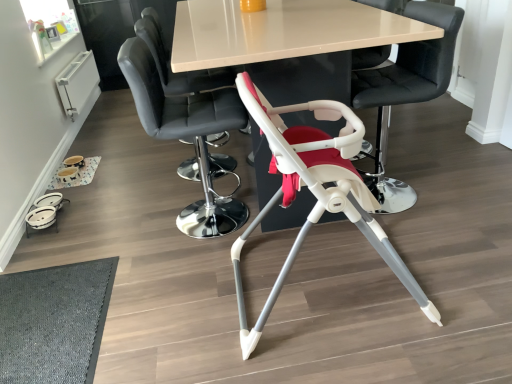
Question: Based on their positions, is dark gray textured mat at lower left located to the left or right of white plastic highchair at center, acting as the fourth chair starting from the left?

Choices:
 (A) left
 (B) right

Answer: (A)

Question: Considering the positions of dark gray textured mat at lower left and white plastic highchair at center, acting as the fourth chair starting from the left, in the image, is dark gray textured mat at lower left wider or thinner than white plastic highchair at center, acting as the fourth chair starting from the left,?

Choices:
 (A) wide
 (B) thin

Answer: (A)

Question: Considering the real-world distances, which object is closest to the white plastic highchair at center, marked as the first chair in a right-to-left arrangement?

Choices:
 (A) smooth leather chair at upper center, which is the first chair in left-to-right order
 (B) smooth black chair at center, the second chair when ordered from left to right
 (C) dark gray textured mat at lower left
 (D) white plastic highchair at center, placed as the second chair when sorted from right to left
 (E) white glossy table at center

Answer: (E)

Question: Which of these objects is positioned farthest from the smooth black chair at center, the second chair when ordered from left to right?

Choices:
 (A) dark gray textured mat at lower left
 (B) white plastic highchair at center, placed as the second chair when sorted from right to left
 (C) white plastic highchair at center, marked as the first chair in a right-to-left arrangement
 (D) white glossy table at center
 (E) smooth leather chair at upper center, which is the first chair in left-to-right order

Answer: (C)